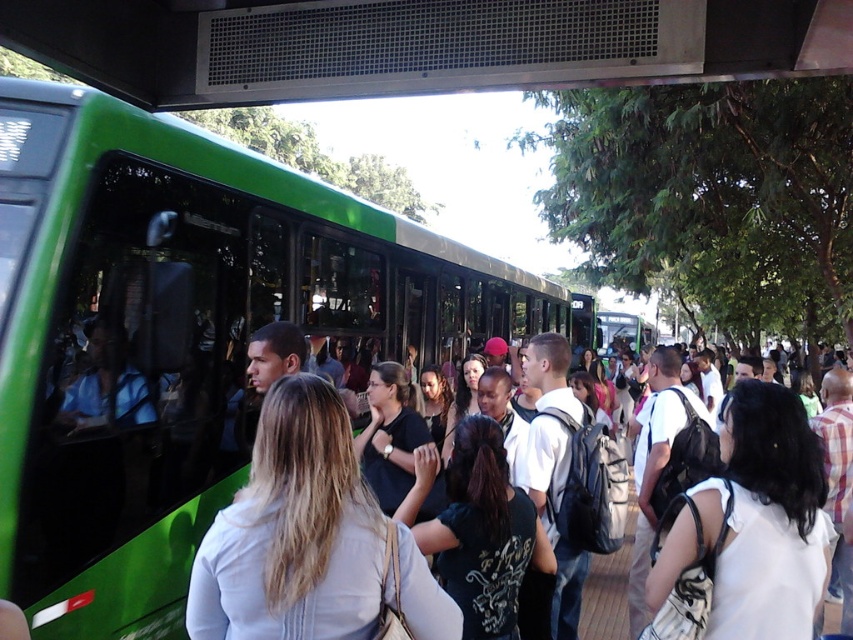
Question: Based on their relative distances, which object is farther from the green matte bus at left?

Choices:
 (A) light brown leather jacket at center
 (B) white fabric shirt at center

Answer: (B)

Question: Which object is farther from the camera taking this photo?

Choices:
 (A) matte black backpack at center
 (B) white fabric shirt at center
 (C) green matte bus at left
 (D) light brown leather jacket at center

Answer: (A)

Question: Is white fabric shirt at center above matte black backpack at center?

Choices:
 (A) no
 (B) yes

Answer: (B)

Question: Does light brown leather jacket at center appear on the left side of white fabric shirt at center?

Choices:
 (A) yes
 (B) no

Answer: (A)

Question: Is white fabric shirt at center thinner than matte black backpack at center?

Choices:
 (A) no
 (B) yes

Answer: (A)

Question: Which point is farther from the camera taking this photo?

Choices:
 (A) (712, 566)
 (B) (163, 500)
 (C) (619, 570)
 (D) (422, 634)

Answer: (C)